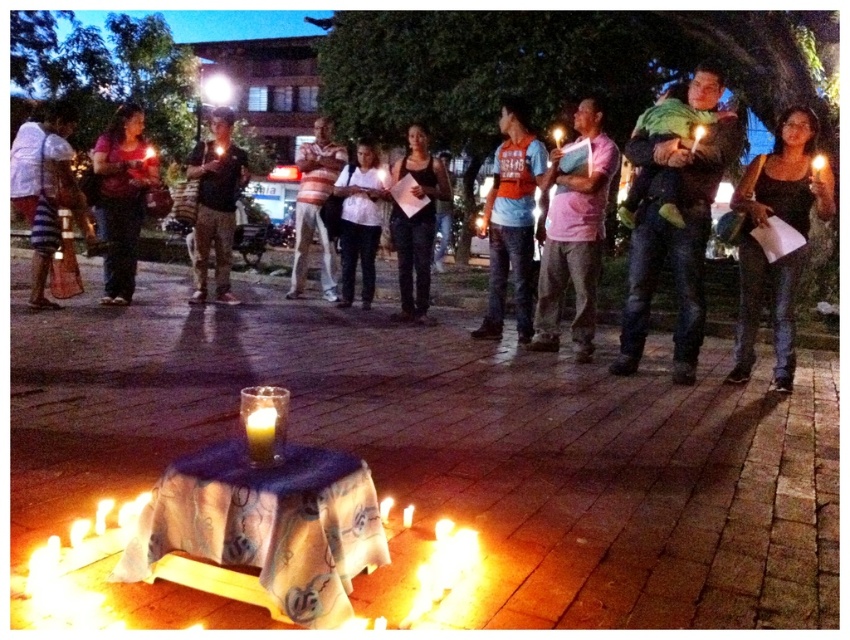
You are organizing a clothing donation drive and need to determine which of the two shirts, the pink cotton shirt at center or the matte black shirt at left, can fit into a narrow donation box that requires items to be less than 10 cm thick. According to the scene description, which shirt is more likely to fit?

The pink cotton shirt at center is thinner than the matte black shirt at left, so the pink cotton shirt at center is more likely to fit into the narrow donation box.